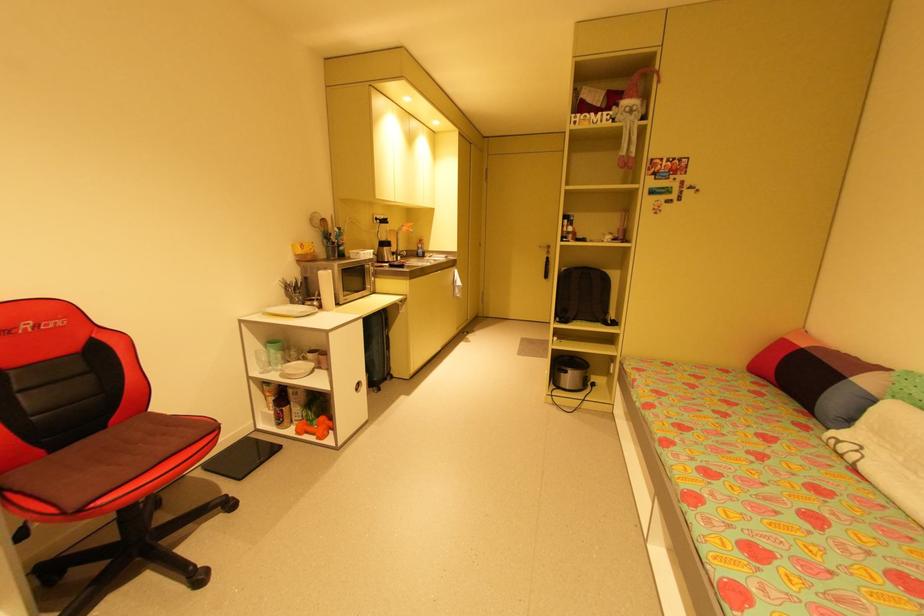
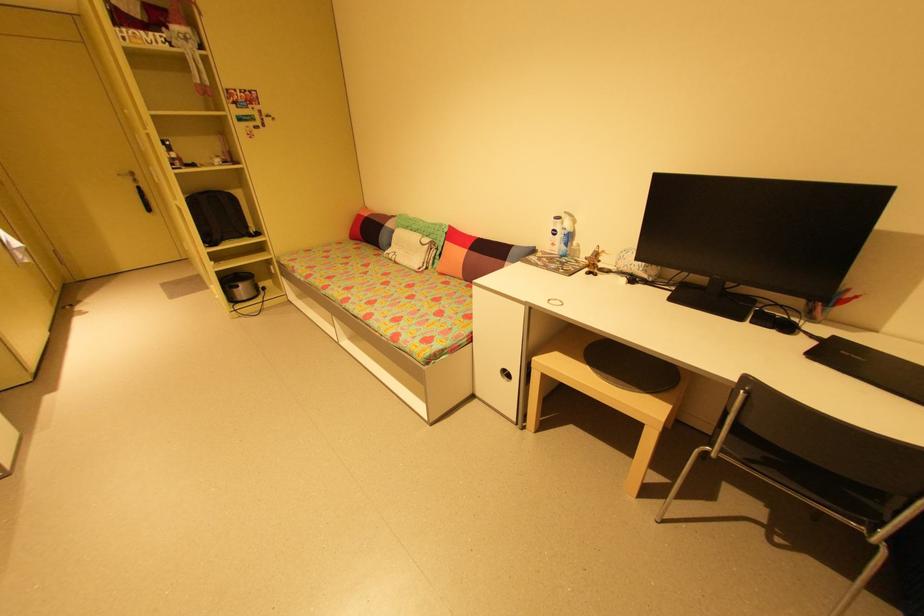
In the second image, find the point that corresponds to point 808,345 in the first image.

(371, 215)